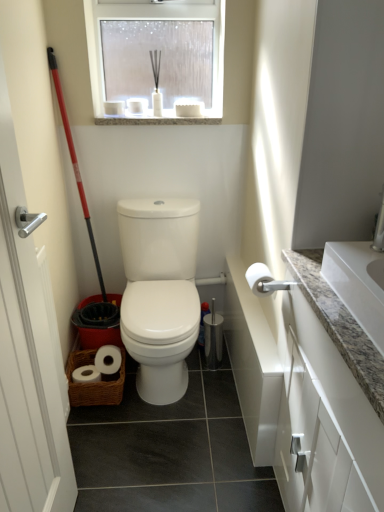
Question: From a real-world perspective, is silver metallic screen door at left below translucent glass window at upper center?

Choices:
 (A) no
 (B) yes

Answer: (B)

Question: Is translucent glass window at upper center completely or partially inside silver metallic screen door at left?

Choices:
 (A) no
 (B) yes

Answer: (A)

Question: Considering the relative sizes of silver metallic screen door at left and translucent glass window at upper center in the image provided, is silver metallic screen door at left taller than translucent glass window at upper center?

Choices:
 (A) no
 (B) yes

Answer: (B)

Question: From the image's perspective, is silver metallic screen door at left on translucent glass window at upper center?

Choices:
 (A) no
 (B) yes

Answer: (A)

Question: Considering the relative sizes of silver metallic screen door at left and translucent glass window at upper center in the image provided, is silver metallic screen door at left wider than translucent glass window at upper center?

Choices:
 (A) no
 (B) yes

Answer: (A)

Question: Is the position of silver metallic screen door at left more distant than that of translucent glass window at upper center?

Choices:
 (A) yes
 (B) no

Answer: (B)

Question: Could you tell me if white matte toilet paper at right is turned towards red plastic shovel at left?

Choices:
 (A) no
 (B) yes

Answer: (A)

Question: Is red plastic shovel at left located within white matte toilet paper at right?

Choices:
 (A) no
 (B) yes

Answer: (A)

Question: Does white matte toilet paper at right come behind red plastic shovel at left?

Choices:
 (A) yes
 (B) no

Answer: (B)

Question: Does white matte toilet paper at right have a larger size compared to red plastic shovel at left?

Choices:
 (A) yes
 (B) no

Answer: (B)

Question: Does white matte toilet paper at right appear on the left side of red plastic shovel at left?

Choices:
 (A) yes
 (B) no

Answer: (B)

Question: Is white matte toilet paper at right turned away from red plastic shovel at left?

Choices:
 (A) no
 (B) yes

Answer: (A)

Question: Are white glossy toilet at center and red plastic shovel at left far apart?

Choices:
 (A) yes
 (B) no

Answer: (B)